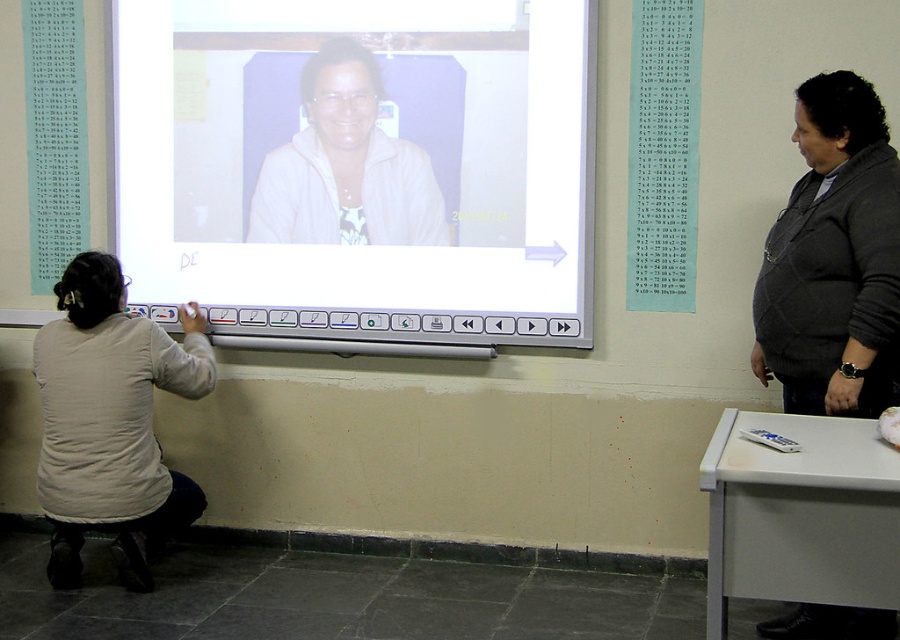
Question: Among these points, which one is nearest to the camera?

Choices:
 (A) (158, 444)
 (B) (876, 248)
 (C) (374, 72)
 (D) (652, 262)

Answer: (B)

Question: Is white glossy projector screen at center thinner than light beige fabric shirt at lower left?

Choices:
 (A) yes
 (B) no

Answer: (B)

Question: Which of the following is the farthest from the observer?

Choices:
 (A) (693, 122)
 (B) (315, 109)
 (C) (876, 353)
 (D) (160, 456)

Answer: (B)

Question: Can you confirm if white glossy projector screen at center is thinner than white paper at upper right?

Choices:
 (A) no
 (B) yes

Answer: (A)

Question: Which object is the farthest from the light beige fabric shirt at lower left?

Choices:
 (A) white matte jacket at upper center
 (B) white paper at upper right
 (C) dark gray sweater at right

Answer: (C)

Question: Is light beige fabric shirt at lower left to the right of white matte jacket at upper center from the viewer's perspective?

Choices:
 (A) no
 (B) yes

Answer: (A)